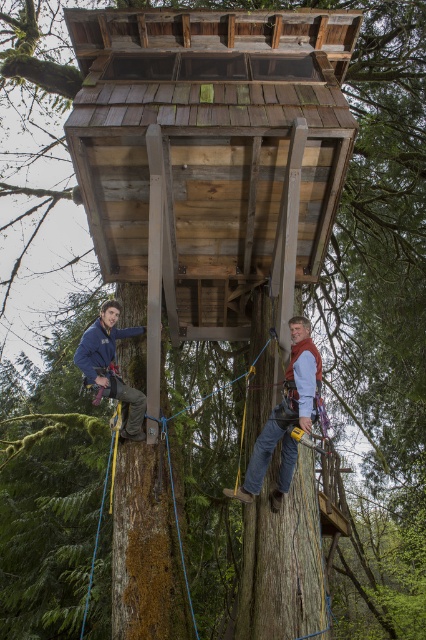
Question: Is wooden platform at center to the right of denim jeans at center from the viewer's perspective?

Choices:
 (A) no
 (B) yes

Answer: (A)

Question: Which point appears farthest from the camera in this image?

Choices:
 (A) (302, 385)
 (B) (137, 28)

Answer: (B)

Question: Observing the image, what is the correct spatial positioning of green mossy bark at lower left in reference to denim jeans at center?

Choices:
 (A) left
 (B) right

Answer: (A)

Question: Is green mossy bark at lower left to the left of matte blue jacket at left from the viewer's perspective?

Choices:
 (A) no
 (B) yes

Answer: (A)

Question: Which object is the closest to the matte blue jacket at left?

Choices:
 (A) green mossy bark at lower left
 (B) denim jeans at center

Answer: (A)

Question: Which point is closer to the camera taking this photo?

Choices:
 (A) (138, 346)
 (B) (227, 285)
 (C) (310, 362)
 (D) (109, 314)

Answer: (C)